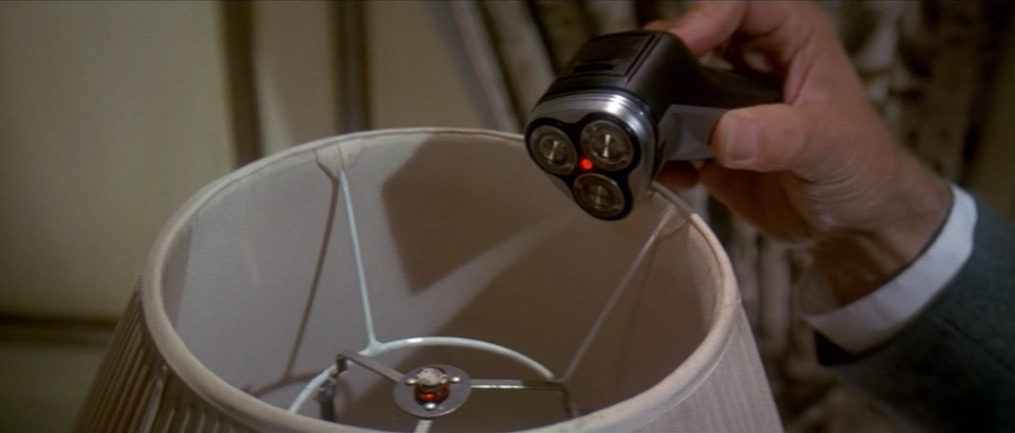
Find the location of `curtain in background`. curtain in background is located at coordinates (898, 85), (546, 40), (604, 21).